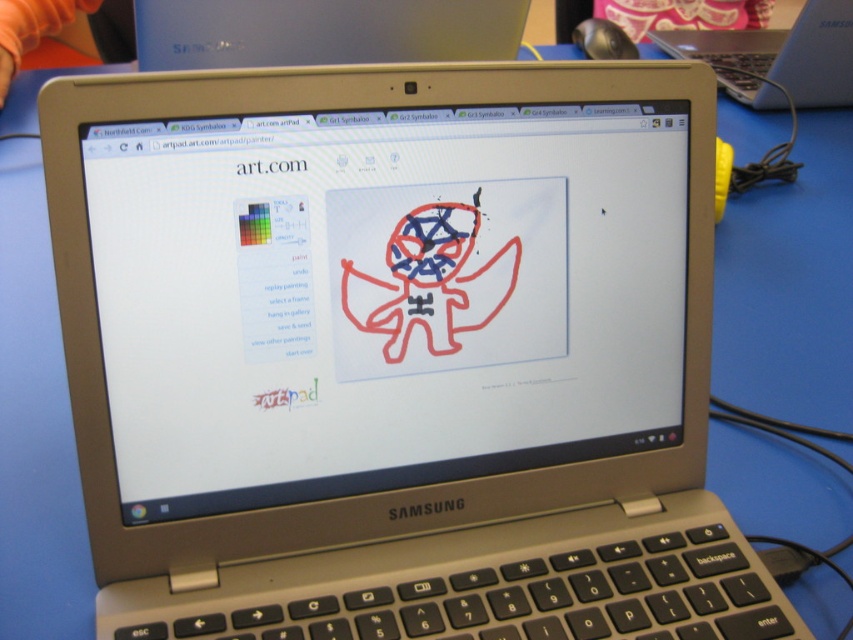
You are an artist trying to locate your Samsung laptop screen in the image. Where is the white glossy computer screen at center located in terms of 2D coordinates?

The white glossy computer screen at center is located at 2D coordinates point (384, 296).

You are an artist trying to decide where to place a new digital canvas. You have a white glossy computer screen at center and a silver metallic laptop at upper center. Which object has a greater width?

The white glossy computer screen at center has a greater width than the silver metallic laptop at upper center.

You are setting up a workspace and need to place a new keyboard next to the white glossy computer screen at center and the silver metallic laptop at upper center. Given that the keyboard is 30 cm wide, can you fit it between them without overlapping?

The white glossy computer screen at center is smaller than the silver metallic laptop at upper center, but since the keyboard is 30 cm wide, it depends on the available space between them. However, the description does not provide exact measurements of the distance between the two objects, so we cannot determine if the keyboard will fit without more information.